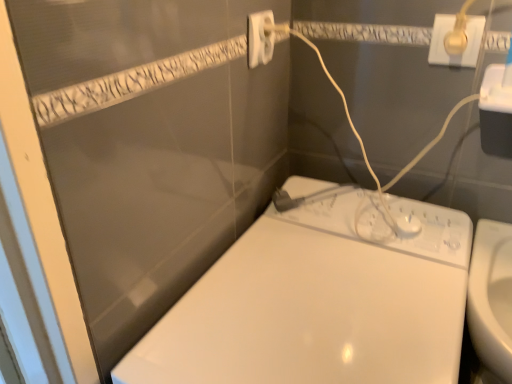
Question: From the image's perspective, is gold metallic plug at upper right, which is the second power plugs and sockets from left to right, located beneath white plastic power plug at upper center, positioned as the first power plugs and sockets in left-to-right order?

Choices:
 (A) yes
 (B) no

Answer: (A)

Question: Can you confirm if gold metallic plug at upper right, which appears as the first power plugs and sockets when viewed from the right, is wider than white plastic power plug at upper center, positioned as the first power plugs and sockets in left-to-right order?

Choices:
 (A) yes
 (B) no

Answer: (B)

Question: Is gold metallic plug at upper right, which appears as the first power plugs and sockets when viewed from the right, not near white plastic power plug at upper center, which appears as the 2th power plugs and sockets when viewed from the right?

Choices:
 (A) yes
 (B) no

Answer: (B)

Question: Can you confirm if gold metallic plug at upper right, which is the second power plugs and sockets from left to right, is smaller than white plastic power plug at upper center, which appears as the 2th power plugs and sockets when viewed from the right?

Choices:
 (A) no
 (B) yes

Answer: (B)

Question: Considering the relative sizes of gold metallic plug at upper right, which appears as the first power plugs and sockets when viewed from the right, and white plastic power plug at upper center, which appears as the 2th power plugs and sockets when viewed from the right, in the image provided, is gold metallic plug at upper right, which appears as the first power plugs and sockets when viewed from the right, thinner than white plastic power plug at upper center, which appears as the 2th power plugs and sockets when viewed from the right,?

Choices:
 (A) no
 (B) yes

Answer: (B)

Question: Does gold metallic plug at upper right, which appears as the first power plugs and sockets when viewed from the right, have a greater height compared to white plastic power plug at upper center, positioned as the first power plugs and sockets in left-to-right order?

Choices:
 (A) no
 (B) yes

Answer: (A)

Question: Is white plastic power plug at upper center, positioned as the first power plugs and sockets in left-to-right order, oriented away from white glossy toilet at lower right?

Choices:
 (A) no
 (B) yes

Answer: (A)

Question: Would you say white glossy toilet at lower right is part of white plastic power plug at upper center, which appears as the 2th power plugs and sockets when viewed from the right,'s contents?

Choices:
 (A) no
 (B) yes

Answer: (A)

Question: Is white plastic power plug at upper center, which appears as the 2th power plugs and sockets when viewed from the right, facing towards white glossy toilet at lower right?

Choices:
 (A) no
 (B) yes

Answer: (A)

Question: Is white plastic power plug at upper center, positioned as the first power plugs and sockets in left-to-right order, bigger than white glossy toilet at lower right?

Choices:
 (A) no
 (B) yes

Answer: (A)

Question: From the image's perspective, is white plastic power plug at upper center, positioned as the first power plugs and sockets in left-to-right order, located beneath white glossy toilet at lower right?

Choices:
 (A) yes
 (B) no

Answer: (B)

Question: Is the depth of white plastic power plug at upper center, positioned as the first power plugs and sockets in left-to-right order, greater than that of white glossy toilet at lower right?

Choices:
 (A) no
 (B) yes

Answer: (B)

Question: Considering the relative sizes of white glossy toilet at lower right and white plastic power plug at upper center, which appears as the 2th power plugs and sockets when viewed from the right, in the image provided, is white glossy toilet at lower right taller than white plastic power plug at upper center, which appears as the 2th power plugs and sockets when viewed from the right,?

Choices:
 (A) no
 (B) yes

Answer: (B)